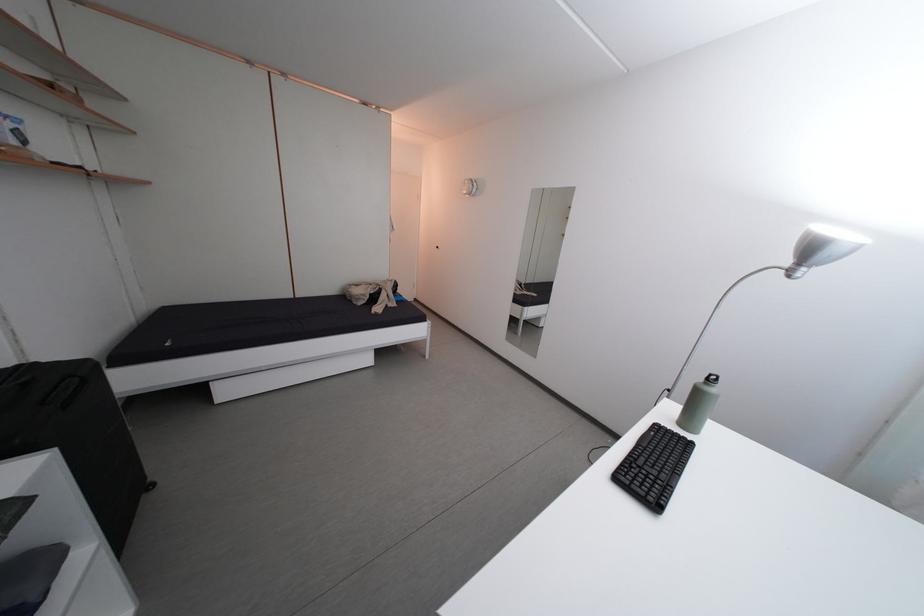
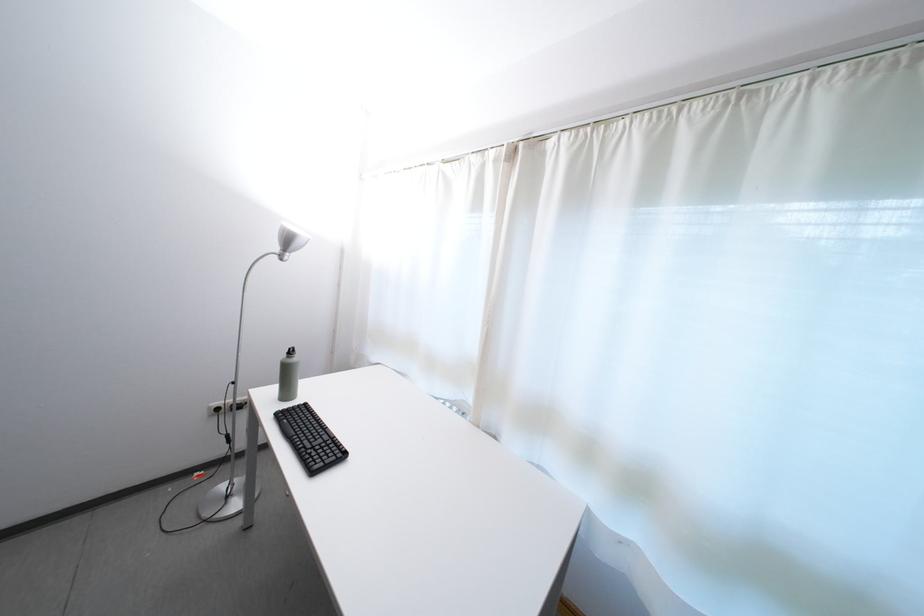
In the second image, find the point that corresponds to [712,386] in the first image.

(294, 361)